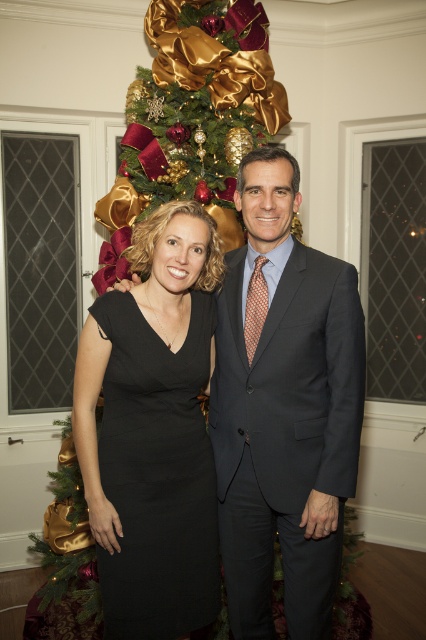
You are planning to take a photo with two subjects in front of a Christmas tree. The dark gray suit at center and the shiny gold ornaments at center are both in the frame. Based on their sizes, which object would appear smaller in the photo?

The dark gray suit at center would appear smaller in the photo since its width is less than that of the shiny gold ornaments at center.

You are a photographer setting up for a portrait in this festive scene. You want to ensure the black satin dress at center is visible above the shiny gold ornaments at center in the final photo. Based on their current positions, is this possible?

The black satin dress at center is currently located below the shiny gold ornaments at center, so adjusting the camera angle or moving the dress upwards would be necessary to achieve the desired visibility.

You are a photographer setting up for a photo shoot in the scene. You want to ensure that both the dark gray suit at center and the shiny gold ornaments at center are in focus. Given that your camera can only focus on objects within a 0.8 meters range, will both subjects be in focus?

The dark gray suit at center and shiny gold ornaments at center are 1.00 meters apart. Since the camera can only focus within a 0.8 meters range, the distance between them exceeds the focus range, so both subjects cannot be in focus simultaneously.